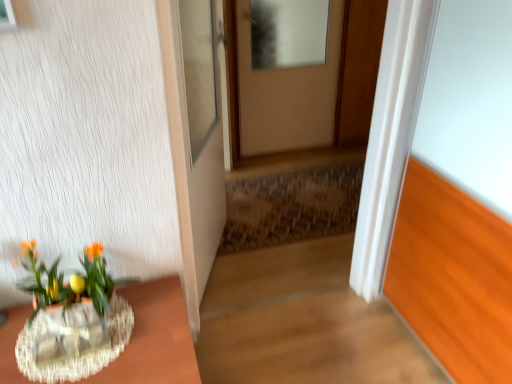
Question: In the image, is translucent glass vase at lower left positioned in front of or behind rustic wooden stairwell at center?

Choices:
 (A) front
 (B) behind

Answer: (A)

Question: Is translucent glass vase at lower left to the left or to the right of rustic wooden stairwell at center in the image?

Choices:
 (A) right
 (B) left

Answer: (B)

Question: Estimate the real-world distances between objects in this image. Which object is farther from the clear glass vase at lower left?

Choices:
 (A) rustic wooden stairwell at center
 (B) white glossy door at center, which ranks as the 2th door in right-to-left order
 (C) translucent glass vase at lower left
 (D) matte beige door at center, which is the first door in back-to-front order

Answer: (D)

Question: Which of these objects is positioned farthest from the clear glass vase at lower left?

Choices:
 (A) rustic wooden stairwell at center
 (B) white glossy door at center, the first door viewed from the left
 (C) matte beige door at center, which is the second door in left-to-right order
 (D) translucent glass vase at lower left

Answer: (C)